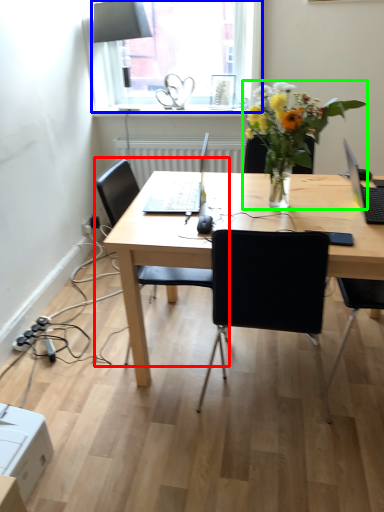
Question: Based on their relative distances, which object is farther from chair (highlighted by a red box)? Choose from window (highlighted by a blue box) and houseplant (highlighted by a green box).

Choices:
 (A) window
 (B) houseplant

Answer: (A)